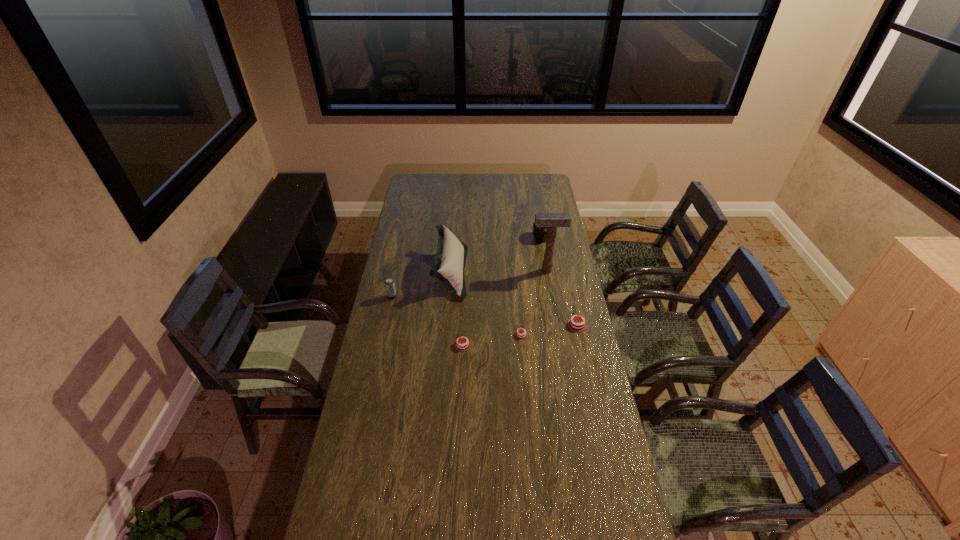
I want to click on free region that satisfies the following two spatial constraints: 1. on the back side of the rightmost chocolate cake; 2. on the front-facing side of the farthest object, so click(558, 238).

This screenshot has width=960, height=540. I want to click on free space in the image that satisfies the following two spatial constraints: 1. on the surface of the fifth tallest object; 2. on the left side of the cushion, so click(x=446, y=325).

Identify the location of vacant space that satisfies the following two spatial constraints: 1. on the front-facing side of the telephoto lens; 2. on the front side of the mallet. (547, 271).

In order to click on free region that satisfies the following two spatial constraints: 1. on the front-facing side of the telephoto lens; 2. on the back side of the rightmost chocolate cake in this screenshot , I will do pos(557,325).

What are the coordinates of `blank area in the image that satisfies the following two spatial constraints: 1. on the surface of the shortest chocolate cake; 2. on the left side of the second tallest object` in the screenshot? It's located at (446, 335).

Identify the location of free location that satisfies the following two spatial constraints: 1. on the front-facing side of the farthest object; 2. on the front side of the leftmost chocolate cake. (560, 345).

Find the location of `vacant position in the image that satisfies the following two spatial constraints: 1. on the back side of the leftmost object; 2. on the right side of the mallet`. vacant position in the image that satisfies the following two spatial constraints: 1. on the back side of the leftmost object; 2. on the right side of the mallet is located at coordinates (397, 271).

Find the location of `free space in the image that satisfies the following two spatial constraints: 1. on the surface of the cushion; 2. on the right side of the fourth object from right to left`. free space in the image that satisfies the following two spatial constraints: 1. on the surface of the cushion; 2. on the right side of the fourth object from right to left is located at coordinates (446, 335).